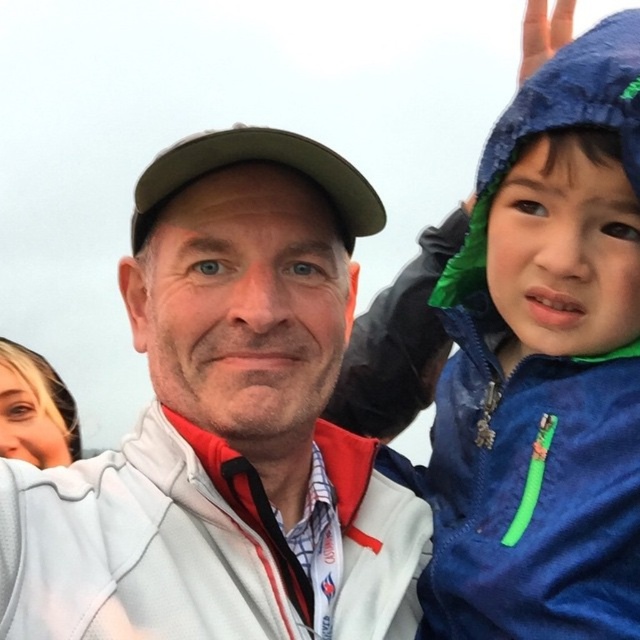
Please describe the location of the white fleece jacket at center in the image using coordinates. The coordinate system has the origin at the bottom left corner of the image, with the x and y axes increasing to the right and up respectively. The coordinates are normalized between 0 and 1.

The white fleece jacket at center is located at coordinates approximately 0.667 on the x axis and 0.356 on the y axis.

You are taking a photo of two people wearing jackets. The white fleece jacket at center and the blue fleece jacket at upper right are in the frame. Which jacket is closer to the left side of the photo?

The white fleece jacket at center is positioned on the left side of the blue fleece jacket at upper right, so it is closer to the left side of the photo.